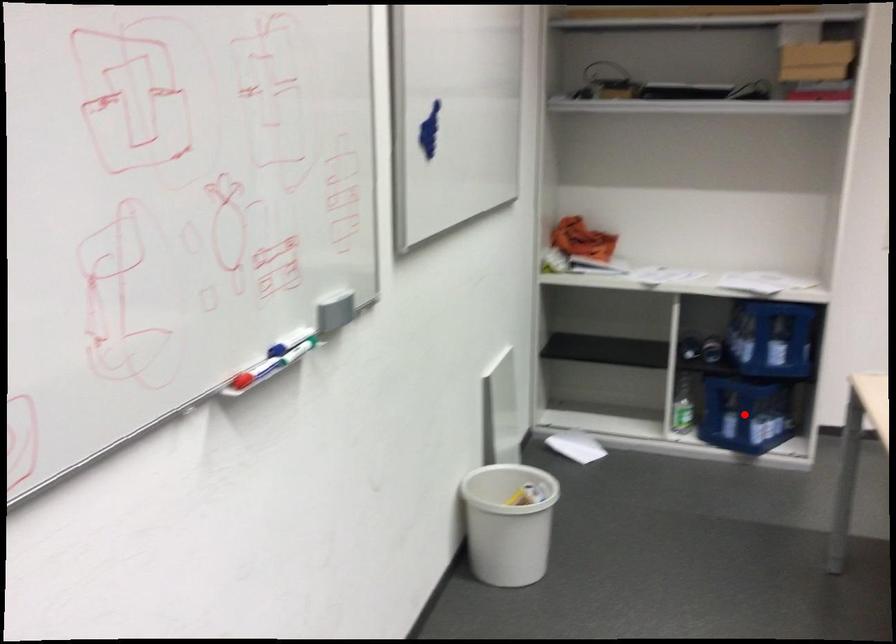
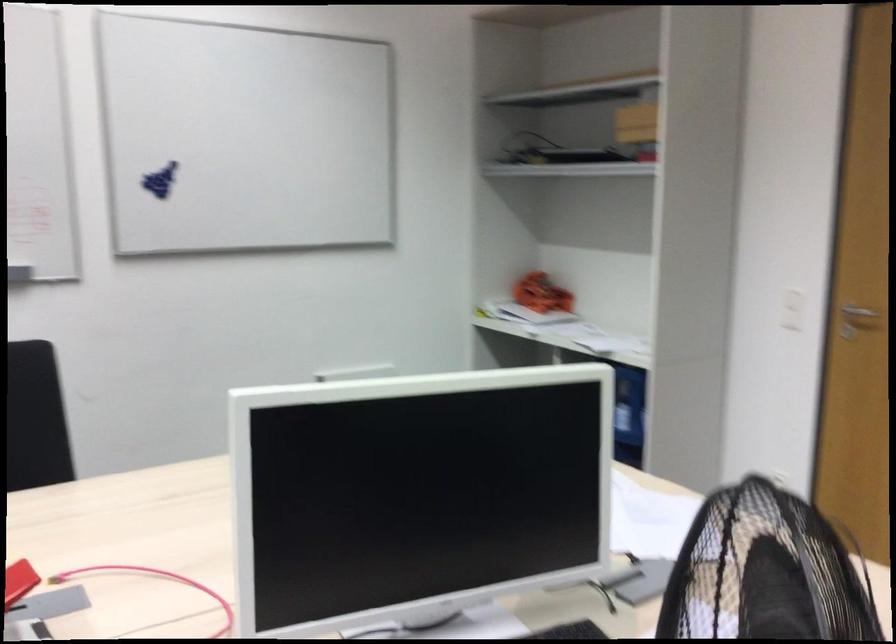
Question: I am providing you with two images of the same scene from different viewpoints. A red point is marked on the first image. Can you still see the location of the red point in image 2?

Choices:
 (A) Yes
 (B) No

Answer: (B)